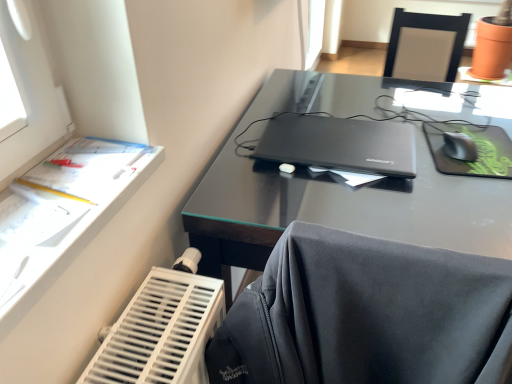
Locate an element on the screen. The image size is (512, 384). free space below black matte mouse pad at right (from a real-world perspective) is located at coordinates point(483,144).